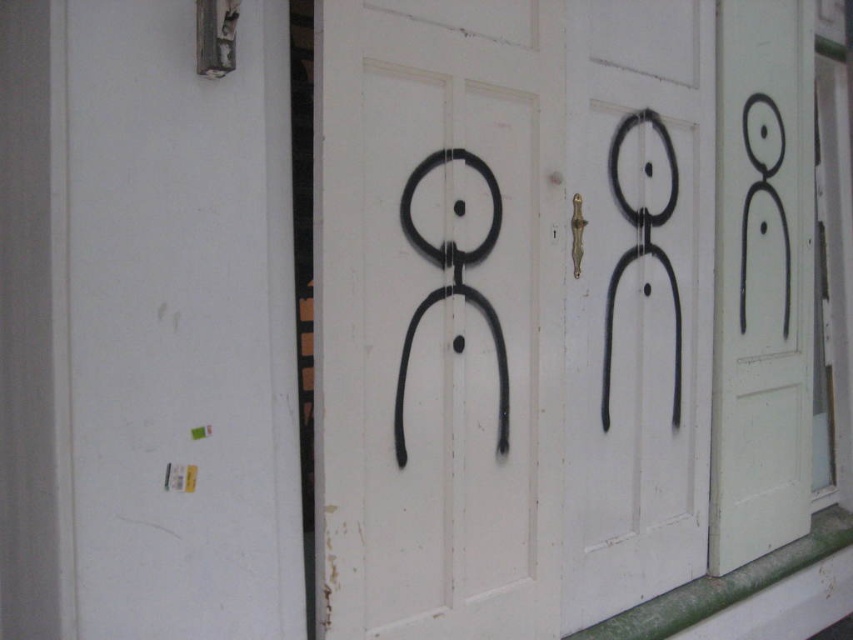
Question: Is black matte door at center below black matte door at right?

Choices:
 (A) yes
 (B) no

Answer: (A)

Question: Observing the image, what is the correct spatial positioning of black matte door at center in reference to black matte door at right?

Choices:
 (A) left
 (B) right

Answer: (A)

Question: Which of the following is the closest to the observer?

Choices:
 (A) black matte figure at center
 (B) black matte door at right

Answer: (A)

Question: Which of these objects is positioned closest to the black matte door at center?

Choices:
 (A) black matte figure at center
 (B) black matte door at right

Answer: (A)

Question: Does black matte figure at center have a lesser width compared to black matte door at right?

Choices:
 (A) no
 (B) yes

Answer: (A)

Question: Which is nearer to the black matte figure at center?

Choices:
 (A) black matte door at right
 (B) black matte door at center

Answer: (B)